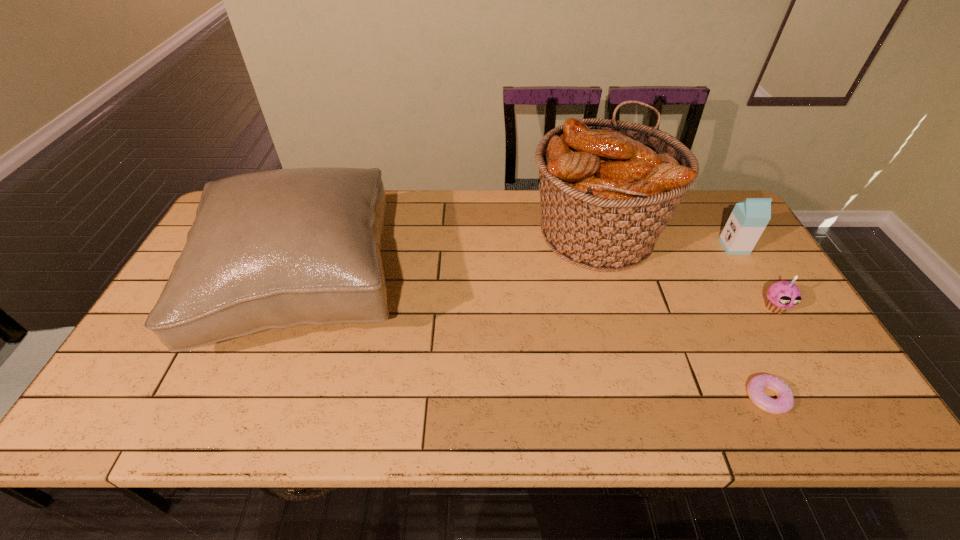
Locate an element on the screen. This screenshot has width=960, height=540. free space between the leftmost object and the cupcake is located at coordinates (540, 297).

Image resolution: width=960 pixels, height=540 pixels. In order to click on vacant point located between the second shortest object and the fourth object from right to left in this screenshot , I will do `click(686, 271)`.

Locate an element on the screen. The height and width of the screenshot is (540, 960). free space between the cushion and the doughnut is located at coordinates (536, 343).

At what (x,y) coordinates should I click in order to perform the action: click on free space between the nearest object and the cushion. Please return your answer as a coordinate pair (x, y). Looking at the image, I should click on (536, 343).

In order to click on empty space between the milk carton and the leftmost object in this screenshot , I will do `click(519, 267)`.

This screenshot has width=960, height=540. In order to click on vacant space in between the fourth tallest object and the doughnut in this screenshot , I will do `click(771, 352)`.

At what (x,y) coordinates should I click in order to perform the action: click on the second closest object to the leftmost object. Please return your answer as a coordinate pair (x, y). Image resolution: width=960 pixels, height=540 pixels. Looking at the image, I should click on (785, 400).

In order to click on object that is the fourth closest to the third shortest object in this screenshot , I will do `click(274, 249)`.

The height and width of the screenshot is (540, 960). What are the coordinates of `vacant area in the image that satisfies the following two spatial constraints: 1. on the back side of the leftmost object; 2. on the right side of the second object from left to right` in the screenshot? It's located at (325, 235).

This screenshot has height=540, width=960. Find the location of `free location that satisfies the following two spatial constraints: 1. on the front side of the third object from right to left; 2. on the left side of the fourth object from right to left`. free location that satisfies the following two spatial constraints: 1. on the front side of the third object from right to left; 2. on the left side of the fourth object from right to left is located at coordinates (643, 397).